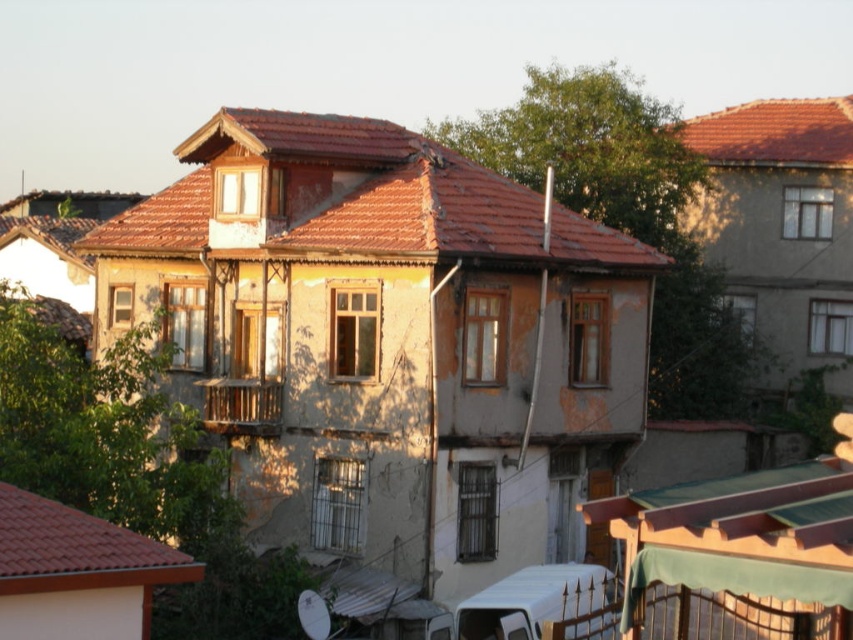
Question: Among these points, which one is farthest from the camera?

Choices:
 (A) click(3, 532)
 (B) click(595, 224)
 (C) click(729, 157)

Answer: (C)

Question: Is red tile roof at lower left positioned at the back of red tile roof at upper right?

Choices:
 (A) no
 (B) yes

Answer: (A)

Question: From the image, what is the correct spatial relationship of red tile roof at lower left in relation to red tile roof at upper right?

Choices:
 (A) below
 (B) above

Answer: (A)

Question: Can you confirm if brown tile roof at center is bigger than red tile roof at upper right?

Choices:
 (A) yes
 (B) no

Answer: (B)

Question: Which object is closer to the camera taking this photo?

Choices:
 (A) red tile roof at upper right
 (B) red tile roof at lower left

Answer: (B)

Question: Which point is closer to the camera taking this photo?

Choices:
 (A) (408, 221)
 (B) (0, 557)

Answer: (B)